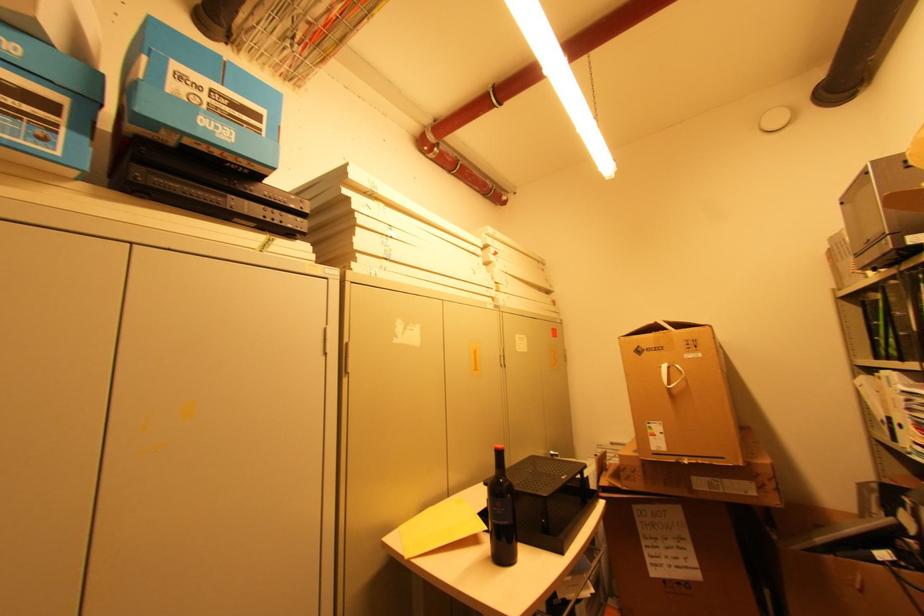
Find where to lift the black binder. Please return your answer as a coordinate pair (x, y).

(908, 314)